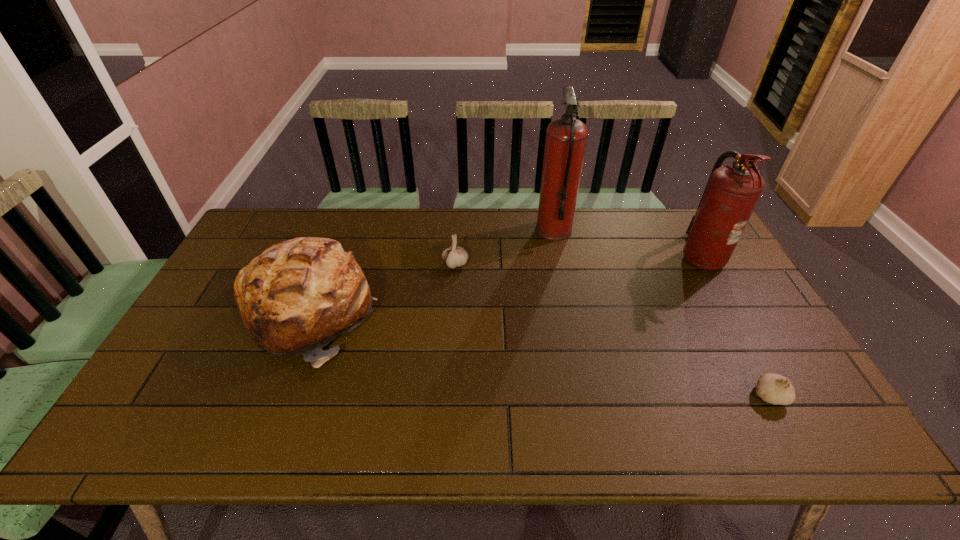
The image size is (960, 540). Identify the location of the third object from right to left. (566, 137).

Where is `the shorter fire extinguisher`? This screenshot has width=960, height=540. the shorter fire extinguisher is located at coordinates (732, 192).

What are the coordinates of `the second tallest object` in the screenshot? It's located at (732, 192).

The height and width of the screenshot is (540, 960). Identify the location of the third shortest object. (298, 295).

The width and height of the screenshot is (960, 540). In order to click on bread in this screenshot , I will do pyautogui.click(x=298, y=295).

Locate an element on the screen. This screenshot has width=960, height=540. the taller garlic is located at coordinates (455, 256).

Identify the location of the farther garlic. (455, 256).

The width and height of the screenshot is (960, 540). What are the coordinates of `the shorter garlic` in the screenshot? It's located at (775, 389).

Identify the location of the shortest object. (775, 389).

Locate an element on the screen. Image resolution: width=960 pixels, height=540 pixels. free spot located at the nozzle of the left fire extinguisher is located at coordinates (508, 231).